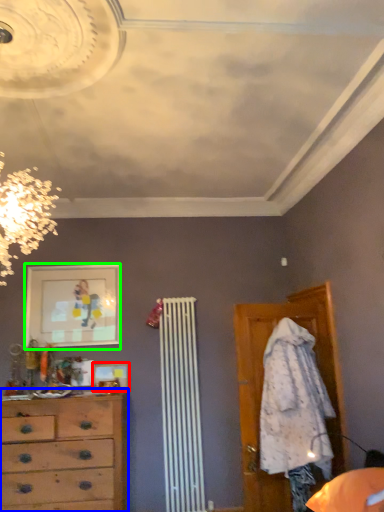
Question: Which object is the closest to the picture frame (highlighted by a red box)? Choose among these: chest of drawers (highlighted by a blue box) or picture frame (highlighted by a green box).

Choices:
 (A) chest of drawers
 (B) picture frame

Answer: (A)